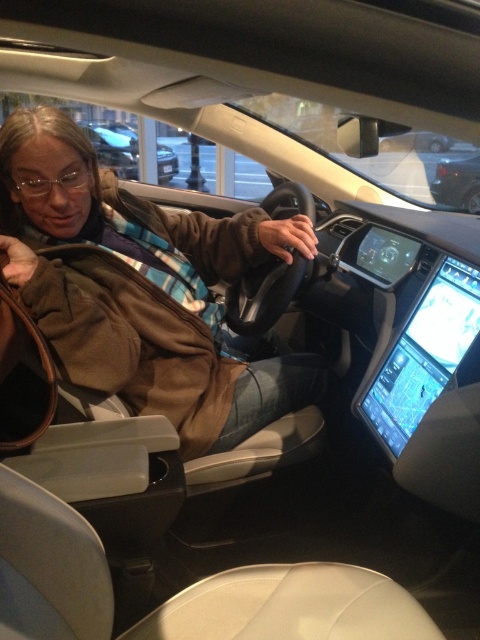
Question: Does brown leather jacket at center have a greater width compared to metallic silver car at upper center?

Choices:
 (A) no
 (B) yes

Answer: (A)

Question: Observing the image, what is the correct spatial positioning of brown leather jacket at center in reference to metallic silver car at upper center?

Choices:
 (A) below
 (B) above

Answer: (A)

Question: Among these points, which one is farthest from the camera?

Choices:
 (A) (463, 186)
 (B) (132, 349)

Answer: (A)

Question: Among these points, which one is nearest to the camera?

Choices:
 (A) (441, 170)
 (B) (169, 163)

Answer: (A)

Question: Does brown leather jacket at center have a smaller size compared to shiny black car at upper right?

Choices:
 (A) yes
 (B) no

Answer: (B)

Question: Which object is the farthest from the shiny black car at upper right?

Choices:
 (A) metallic silver car at upper center
 (B) brown leather jacket at center

Answer: (A)